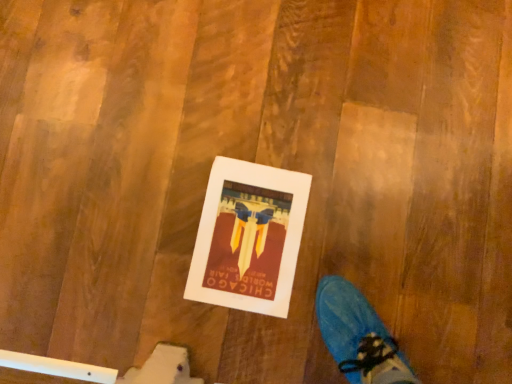
This screenshot has width=512, height=384. I want to click on free point to the left of matte paper postcard at center, so click(x=148, y=200).